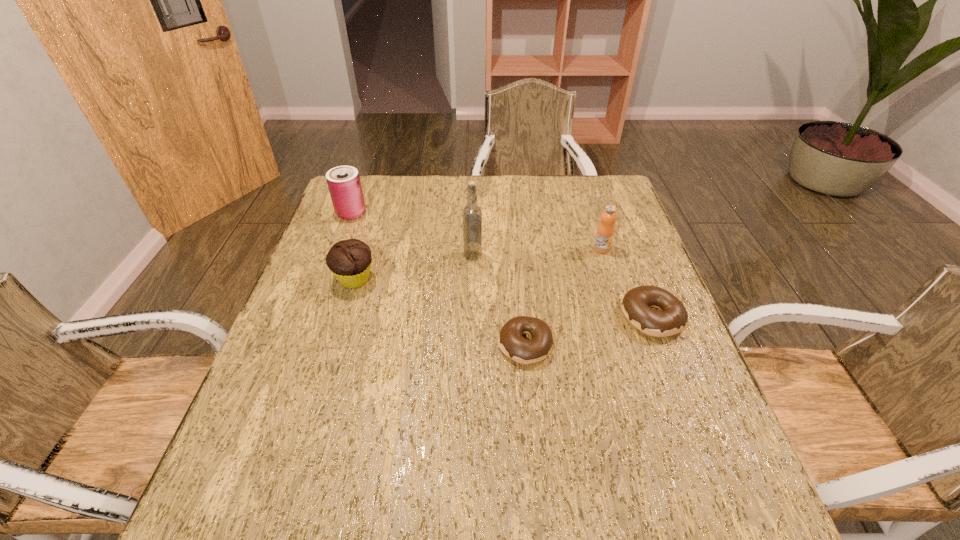
Find the location of `the shorter doughnut`. the shorter doughnut is located at coordinates (511, 342).

This screenshot has height=540, width=960. In order to click on the shortest object in this screenshot , I will do `click(511, 342)`.

At what (x,y) coordinates should I click in order to perform the action: click on the taller doughnut. Please return your answer as a coordinate pair (x, y). Looking at the image, I should click on (636, 303).

Find the location of `the right doughnut`. the right doughnut is located at coordinates (636, 303).

I want to click on the farthest object, so click(344, 184).

At what (x,y) coordinates should I click in order to perform the action: click on orange juice. Please return your answer as a coordinate pair (x, y). Image resolution: width=960 pixels, height=540 pixels. Looking at the image, I should click on (605, 231).

Where is `vodka`? This screenshot has height=540, width=960. vodka is located at coordinates (472, 214).

Where is `the tallest object`? The image size is (960, 540). the tallest object is located at coordinates (472, 214).

Find the location of a particular element. the fourth tallest object is located at coordinates (349, 260).

You are a GUI agent. You are given a task and a screenshot of the screen. Output one action in this format:
    pyautogui.click(x=<x>, y=<y>)
    Task: Click on the vacant space situated on the front of the shorter doughnut
    This screenshot has width=960, height=540.
    Given the screenshot: What is the action you would take?
    pyautogui.click(x=533, y=428)